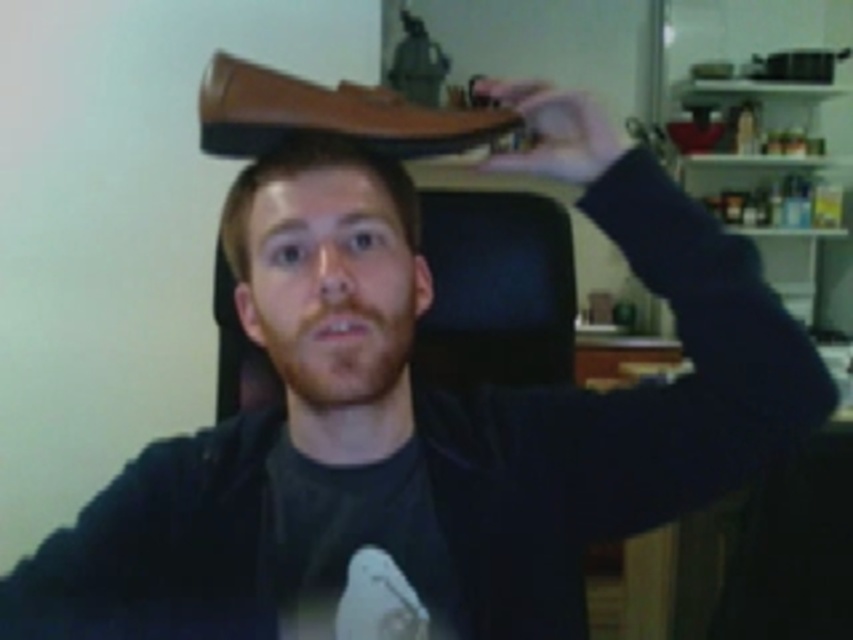
Measure the distance between brown leather hat at center and matte brown shoe at upper center.

brown leather hat at center and matte brown shoe at upper center are 2.31 meters apart from each other.

Between point (234, 212) and point (556, 104), which one is positioned in front?

Point (556, 104) is in front.

The image size is (853, 640). Find the location of `brown leather hat at center`. brown leather hat at center is located at coordinates (247, 257).

Between brown leather shoe at upper center and matte brown shoe at upper center, which one is positioned lower?

brown leather shoe at upper center

Between brown leather shoe at upper center and matte brown shoe at upper center, which one is positioned higher?

matte brown shoe at upper center is above.

Who is more distant from viewer, (259, 84) or (531, 99)?

The point (531, 99) is more distant.

This screenshot has height=640, width=853. In order to click on brown leather shoe at upper center in this screenshot , I will do `click(329, 113)`.

From the picture: Between brown leather shoe at upper center and brown leather hat at center, which one appears on the left side from the viewer's perspective?

From the viewer's perspective, brown leather hat at center appears more on the left side.

Between brown leather shoe at upper center and brown leather hat at center, which one has more height?

brown leather hat at center is taller.

Who is more distant from viewer, (258, 145) or (369, 168)?

The point (258, 145) is behind.

At what (x,y) coordinates should I click in order to perform the action: click on brown leather shoe at upper center. Please return your answer as a coordinate pair (x, y). The width and height of the screenshot is (853, 640). Looking at the image, I should click on (329, 113).